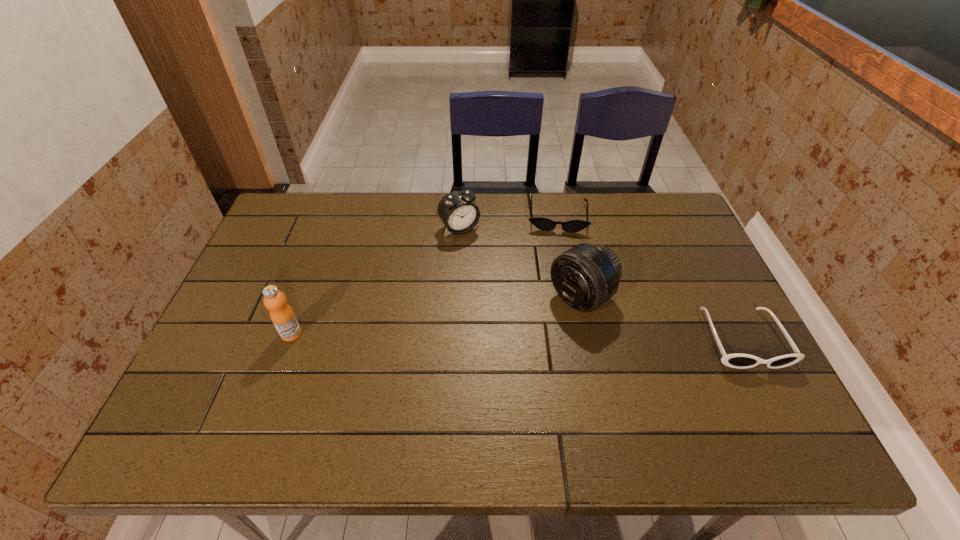
Image resolution: width=960 pixels, height=540 pixels. What are the coordinates of `sunglasses at the far edge` in the screenshot? It's located at (545, 224).

Locate an element on the screen. This screenshot has height=540, width=960. object that is at the right edge is located at coordinates (741, 361).

In the image, there is a desktop. Identify the location of vacant space at the far edge. The height and width of the screenshot is (540, 960). (358, 214).

The height and width of the screenshot is (540, 960). In order to click on blank space at the near edge of the desktop in this screenshot , I will do `click(428, 406)`.

In the image, there is a desktop. Where is `vacant region at the far left corner`? vacant region at the far left corner is located at coordinates coord(319,194).

Find the location of `free space at the far right corner`. free space at the far right corner is located at coordinates (656, 230).

I want to click on unoccupied area between the shorter sunglasses and the alarm clock, so [x=508, y=222].

At what (x,y) coordinates should I click in order to perform the action: click on free spot between the farther sunglasses and the orange juice. Please return your answer as a coordinate pair (x, y). Looking at the image, I should click on (424, 275).

The height and width of the screenshot is (540, 960). In order to click on free space that is in between the nearer sunglasses and the left sunglasses in this screenshot , I will do `click(650, 278)`.

Identify the location of free space between the right sunglasses and the leftmost object. The height and width of the screenshot is (540, 960). (516, 336).